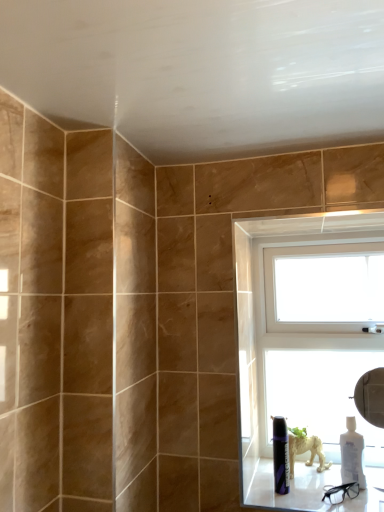
You are a GUI agent. You are given a task and a screenshot of the screen. Output one action in this format:
    pyautogui.click(x=<x>, y=<y>)
    Task: Click on the vacant area situated to the left side of white glossy bottle at lower right
    The height and width of the screenshot is (512, 384).
    Given the screenshot: What is the action you would take?
    pyautogui.click(x=314, y=494)